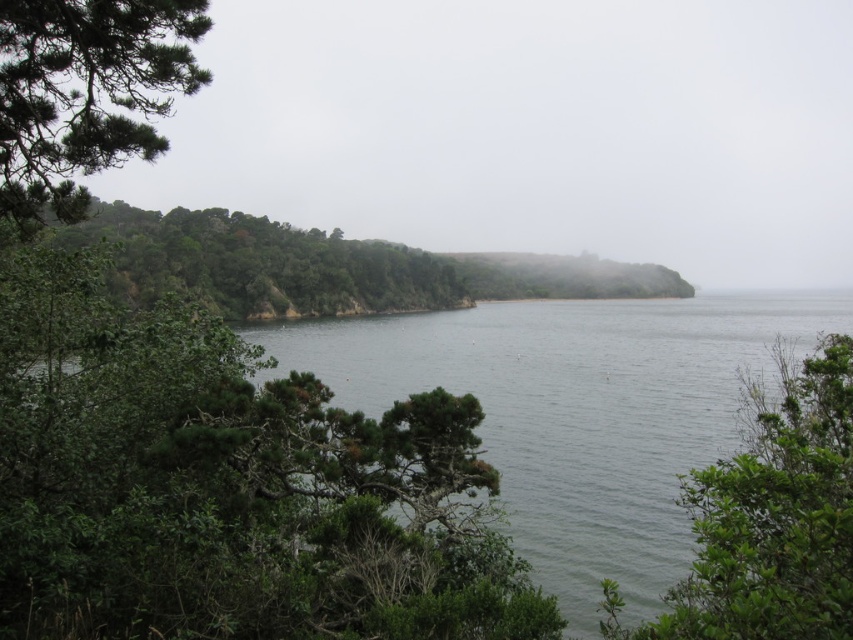
You are standing in the coastal landscape and want to walk towards the green leafy trees at left. Which direction should you head to avoid the green leafy tree at lower right?

To reach the green leafy trees at left while avoiding the green leafy tree at lower right, you should head to the left side since the green leafy tree at lower right is positioned on the right side of the green leafy trees at left.